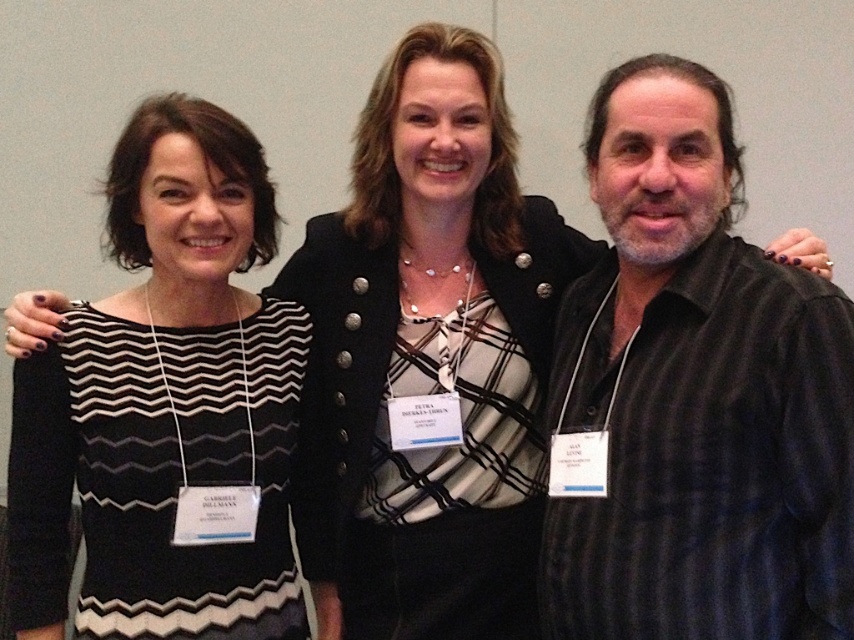
Does point (722, 563) come closer to viewer compared to point (120, 488)?

Yes, it is.

Which of these two, black striped shirt at right or black striped dress at left, stands shorter?

black striped shirt at right

Does point (640, 305) come closer to viewer compared to point (223, 250)?

Yes.

You are a GUI agent. You are given a task and a screenshot of the screen. Output one action in this format:
    pyautogui.click(x=<x>, y=<y>)
    Task: Click on the black striped shirt at right
    The height and width of the screenshot is (640, 854).
    Given the screenshot: What is the action you would take?
    pyautogui.click(x=693, y=397)